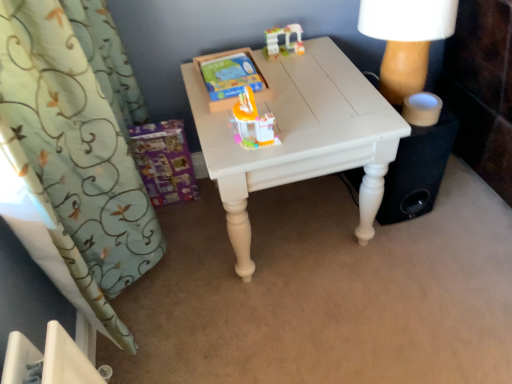
Locate an element on the screen. The width and height of the screenshot is (512, 384). free area in between green floral fabric curtain at left and white painted wood table at center is located at coordinates coord(219,278).